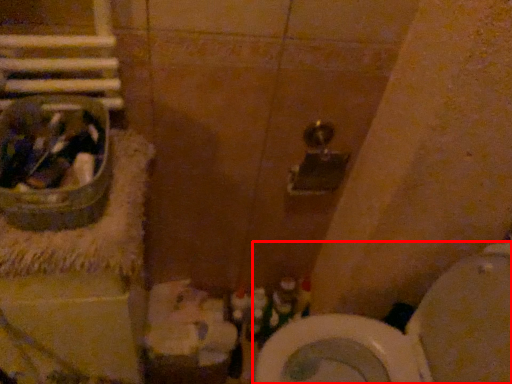
Question: From the image's perspective, considering the relative positions of toilet (annotated by the red box) and sink in the image provided, where is toilet (annotated by the red box) located with respect to the staircase?

Choices:
 (A) above
 (B) below

Answer: (B)